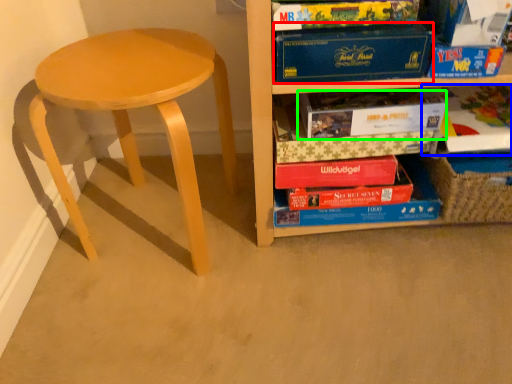
Question: Which is farther away from paperback book (highlighted by a red box)? book (highlighted by a blue box) or paperback book (highlighted by a green box)?

Choices:
 (A) book
 (B) paperback book

Answer: (A)